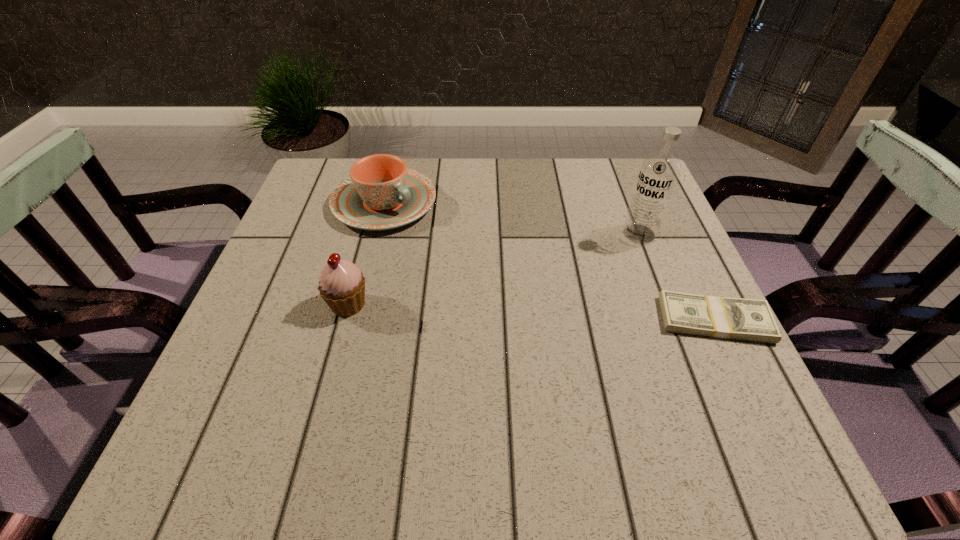
At what (x,y) coordinates should I click in order to perform the action: click on vacant position at the left edge of the desktop. Please return your answer as a coordinate pair (x, y). Looking at the image, I should click on (296, 214).

Image resolution: width=960 pixels, height=540 pixels. Find the location of `vacant space at the far left corner of the desktop`. vacant space at the far left corner of the desktop is located at coordinates (321, 183).

In the image, there is a desktop. Where is `vacant region at the far right corner`? vacant region at the far right corner is located at coordinates (601, 180).

Where is `free space between the cupcake and the dollar`? free space between the cupcake and the dollar is located at coordinates (532, 312).

You are a GUI agent. You are given a task and a screenshot of the screen. Output one action in this format:
    pyautogui.click(x=<x>, y=<y>)
    Task: Click on the empty space between the tallest object and the third tallest object
    This screenshot has height=540, width=960.
    Given the screenshot: What is the action you would take?
    pyautogui.click(x=512, y=219)

Find the location of a particular element. This screenshot has height=540, width=960. vacant space in between the chinaware and the vodka is located at coordinates (512, 219).

At what (x,y) coordinates should I click in order to perform the action: click on free space between the chinaware and the shortest object. Please return your answer as a coordinate pair (x, y). This screenshot has height=540, width=960. Looking at the image, I should click on (549, 261).

You are a GUI agent. You are given a task and a screenshot of the screen. Output one action in this format:
    pyautogui.click(x=<x>, y=<y>)
    Task: Click on the vacant area that lies between the cupcake and the tallest object
    This screenshot has height=540, width=960.
    Given the screenshot: What is the action you would take?
    pyautogui.click(x=493, y=269)

This screenshot has width=960, height=540. I want to click on free space between the vodka and the third shortest object, so click(493, 269).

At what (x,y) coordinates should I click in order to perform the action: click on vacant point located between the second shortest object and the shortest object. Please return your answer as a coordinate pair (x, y). The width and height of the screenshot is (960, 540). Looking at the image, I should click on (549, 261).